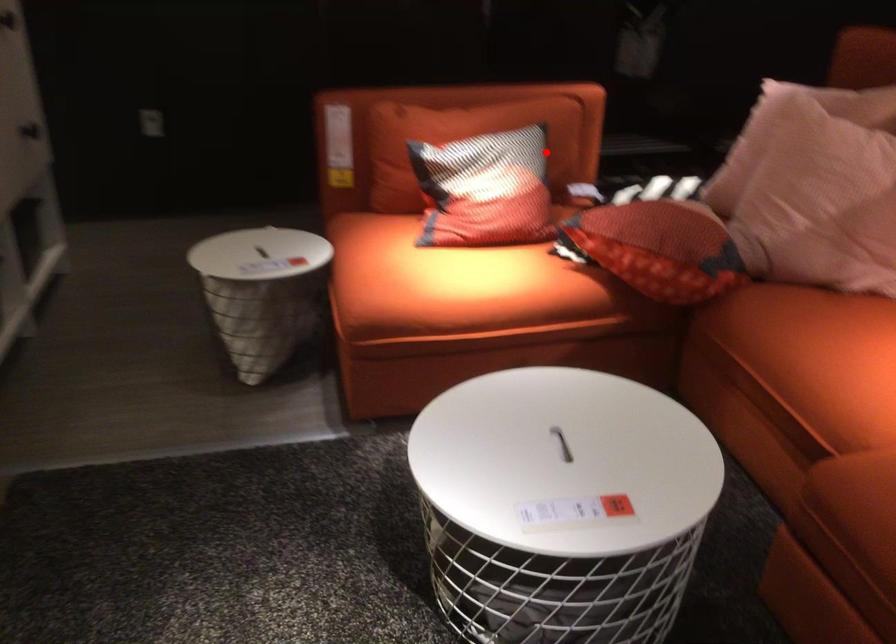
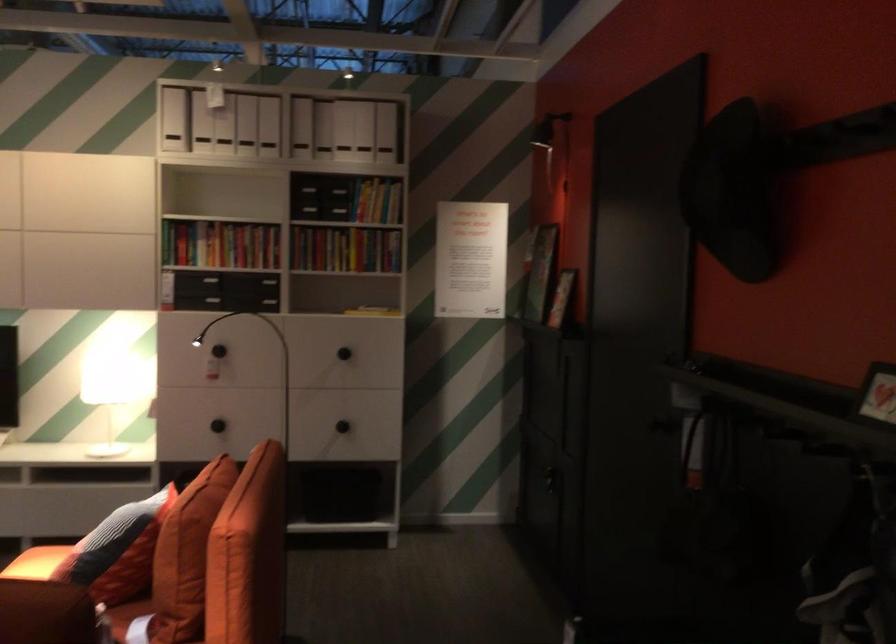
Where in the second image is the point corresponding to the highlighted location from the first image?

(117, 551)